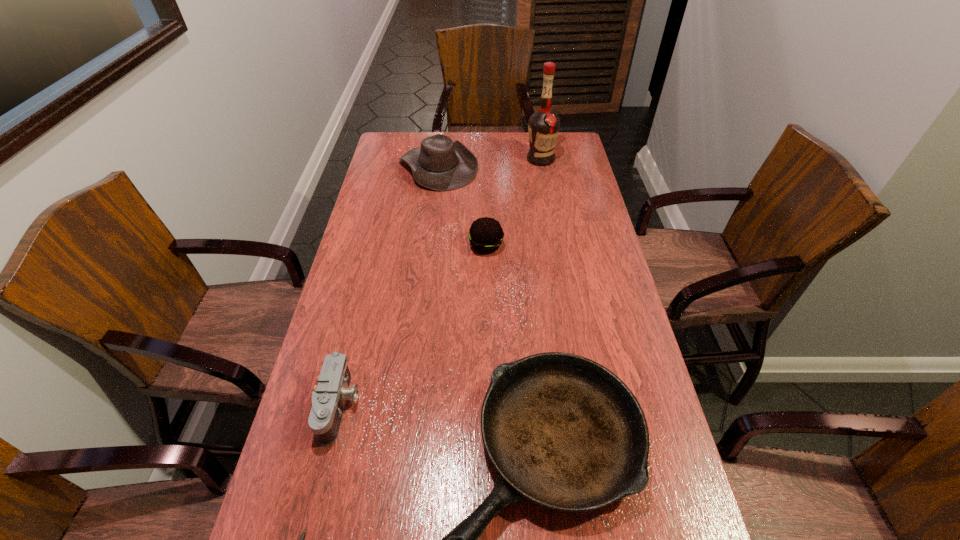
Locate an element on the screen. The width and height of the screenshot is (960, 540). vacant area that lies between the camera and the patty is located at coordinates (413, 326).

What are the coordinates of `object that is the closest to the patty` in the screenshot? It's located at (441, 164).

Locate an element on the screen. This screenshot has height=540, width=960. object that is the second nearest to the camera is located at coordinates (562, 431).